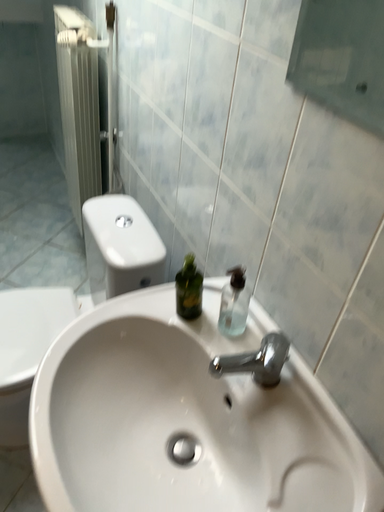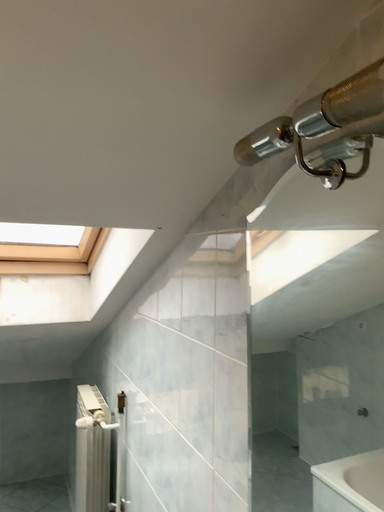
Question: Which way did the camera rotate in the video?

Choices:
 (A) rotated upward
 (B) rotated downward

Answer: (A)